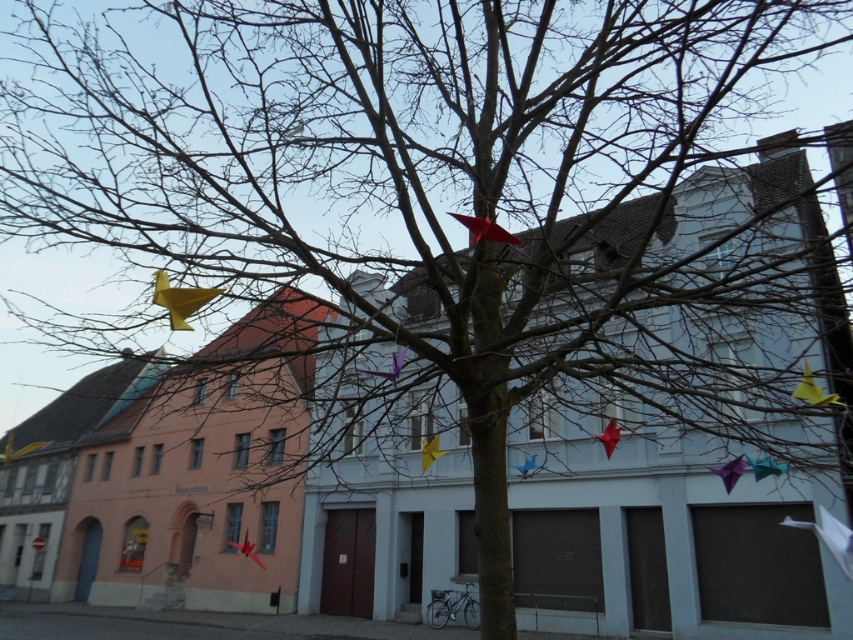
Question: Which object is the closest to the teal fabric flag at center right?

Choices:
 (A) yellow paper flag at center
 (B) yellow paper bird at center
 (C) red paper flag at upper center
 (D) blue glossy kite at center

Answer: (A)

Question: Does teal fabric flag at center right lie behind red paper flag at lower center?

Choices:
 (A) yes
 (B) no

Answer: (B)

Question: Which object is positioned closest to the blue glossy kite at center?

Choices:
 (A) white paper flag at lower right
 (B) teal fabric flag at center right
 (C) yellow paper flag at center

Answer: (C)

Question: Is the position of teal fabric flag at center right more distant than that of yellow paper flag at center?

Choices:
 (A) no
 (B) yes

Answer: (B)

Question: Which point is closer to the camera?

Choices:
 (A) (804, 392)
 (B) (607, 428)

Answer: (A)

Question: Does yellow paper bird at center appear on the right side of red paper flag at lower center?

Choices:
 (A) no
 (B) yes

Answer: (B)